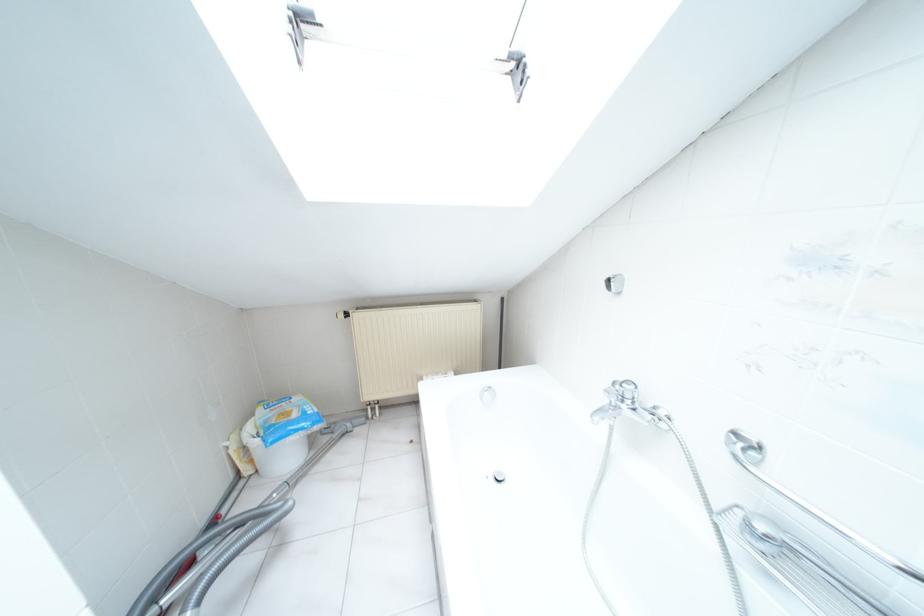
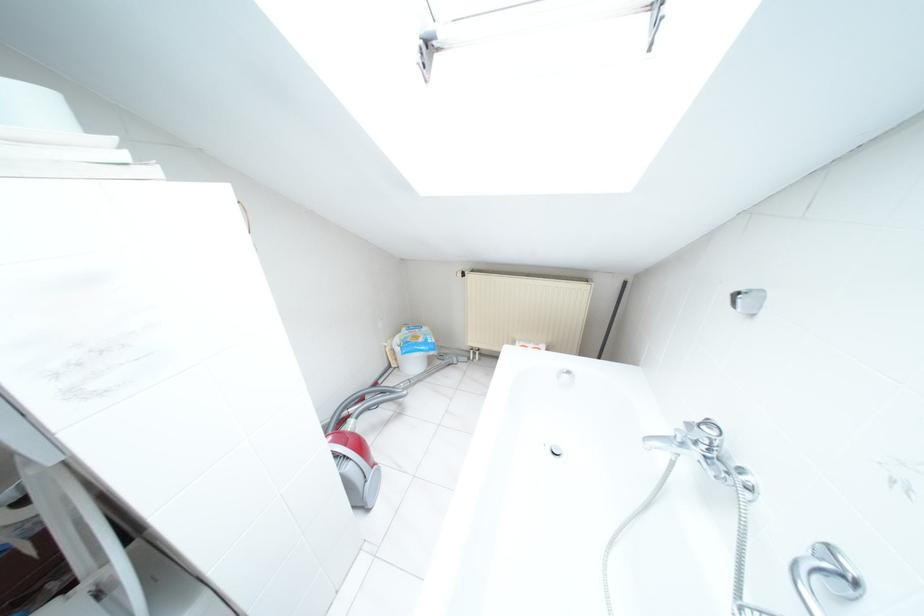
In the second image, find the point that corresponds to (x=630, y=387) in the first image.

(711, 432)